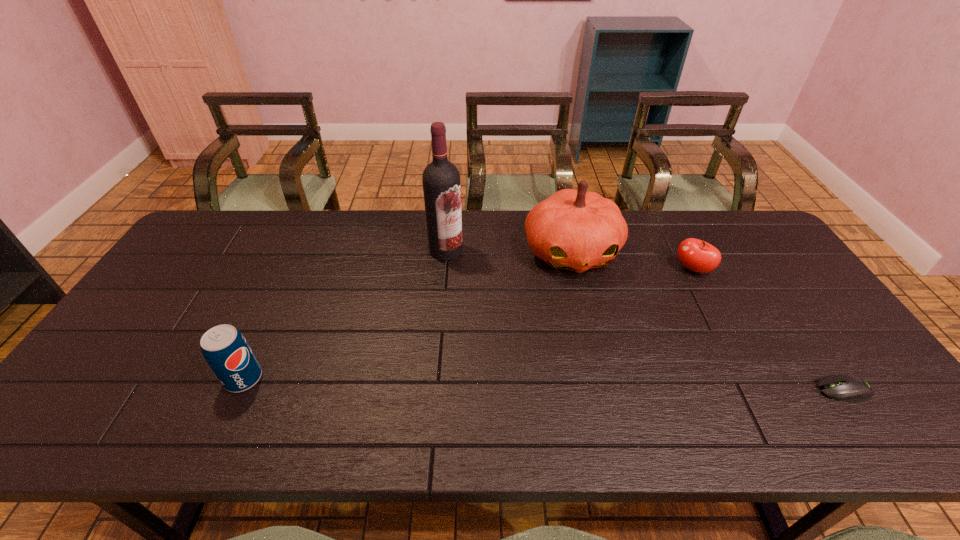
Find the location of a particular element. The image size is (960, 540). vacant space located on the stem of the second object from right to left is located at coordinates (660, 295).

I want to click on vacant region located 0.070m on the stem of the second object from right to left, so click(669, 288).

Find the location of a particular element. Image resolution: width=960 pixels, height=540 pixels. vacant space located on the stem of the second object from right to left is located at coordinates (611, 336).

I want to click on wine bottle situated at the far edge, so click(x=441, y=179).

At what (x,y) coordinates should I click in order to perform the action: click on pumpkin located in the far edge section of the desktop. Please return your answer as a coordinate pair (x, y). Looking at the image, I should click on (576, 230).

Locate an element on the screen. The height and width of the screenshot is (540, 960). pop that is positioned at the near edge is located at coordinates (225, 349).

Find the location of `computer mouse that is at the near edge`. computer mouse that is at the near edge is located at coordinates (849, 388).

The height and width of the screenshot is (540, 960). I want to click on object that is positioned at the right edge, so click(x=849, y=388).

I want to click on object located in the near right corner section of the desktop, so click(849, 388).

At what (x,y) coordinates should I click in order to perform the action: click on vacant space at the far edge. Please return your answer as a coordinate pair (x, y). This screenshot has height=540, width=960. Looking at the image, I should click on (400, 232).